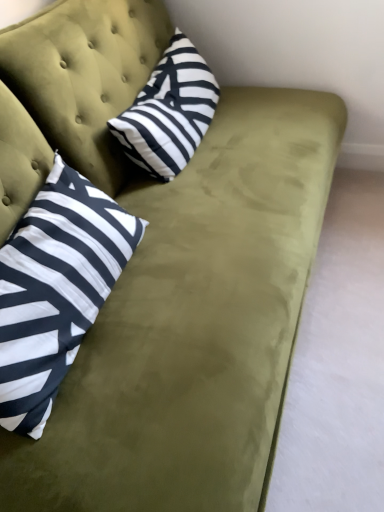
Question: Would you say white and black striped pillow at left, which ranks as the first pillow in bottom-to-top order, is outside black and white striped pillow at upper center, the first pillow in the top-to-bottom sequence?

Choices:
 (A) yes
 (B) no

Answer: (A)

Question: Does white and black striped pillow at left, the 2th pillow positioned from the top, have a smaller size compared to black and white striped pillow at upper center, the first pillow in the top-to-bottom sequence?

Choices:
 (A) yes
 (B) no

Answer: (B)

Question: Does white and black striped pillow at left, the 2th pillow positioned from the top, come behind black and white striped pillow at upper center, the second pillow in the bottom-to-top sequence?

Choices:
 (A) yes
 (B) no

Answer: (B)

Question: Can you confirm if white and black striped pillow at left, the 2th pillow positioned from the top, is bigger than black and white striped pillow at upper center, the first pillow in the top-to-bottom sequence?

Choices:
 (A) yes
 (B) no

Answer: (A)

Question: From a real-world perspective, is white and black striped pillow at left, the 2th pillow positioned from the top, positioned under black and white striped pillow at upper center, the first pillow in the top-to-bottom sequence, based on gravity?

Choices:
 (A) no
 (B) yes

Answer: (A)

Question: Is white and black striped pillow at left, the 2th pillow positioned from the top, in contact with black and white striped pillow at upper center, the first pillow in the top-to-bottom sequence?

Choices:
 (A) yes
 (B) no

Answer: (B)

Question: Is black and white striped pillow at upper center, the second pillow in the bottom-to-top sequence, to the left of white and black striped pillow at left, which ranks as the first pillow in bottom-to-top order, from the viewer's perspective?

Choices:
 (A) no
 (B) yes

Answer: (A)

Question: From a real-world perspective, is black and white striped pillow at upper center, the first pillow in the top-to-bottom sequence, on white and black striped pillow at left, which ranks as the first pillow in bottom-to-top order?

Choices:
 (A) no
 (B) yes

Answer: (A)

Question: Is there a large distance between black and white striped pillow at upper center, the first pillow in the top-to-bottom sequence, and white and black striped pillow at left, which ranks as the first pillow in bottom-to-top order?

Choices:
 (A) no
 (B) yes

Answer: (A)

Question: Is black and white striped pillow at upper center, the second pillow in the bottom-to-top sequence, touching white and black striped pillow at left, the 2th pillow positioned from the top?

Choices:
 (A) yes
 (B) no

Answer: (B)

Question: From the image's perspective, is black and white striped pillow at upper center, the second pillow in the bottom-to-top sequence, located beneath white and black striped pillow at left, the 2th pillow positioned from the top?

Choices:
 (A) no
 (B) yes

Answer: (A)

Question: Considering the relative positions of black and white striped pillow at upper center, the first pillow in the top-to-bottom sequence, and white and black striped pillow at left, which ranks as the first pillow in bottom-to-top order, in the image provided, is black and white striped pillow at upper center, the first pillow in the top-to-bottom sequence, behind white and black striped pillow at left, which ranks as the first pillow in bottom-to-top order,?

Choices:
 (A) yes
 (B) no

Answer: (A)

Question: Relative to white and black striped pillow at left, which ranks as the first pillow in bottom-to-top order, is black and white striped pillow at upper center, the second pillow in the bottom-to-top sequence, in front or behind?

Choices:
 (A) behind
 (B) front

Answer: (A)